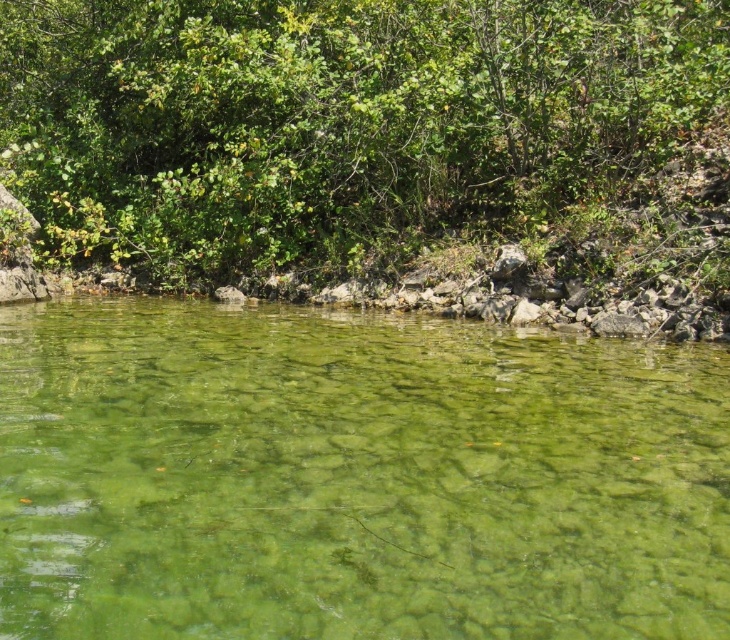
You are standing at the edge of the water and want to reach both the point at coordinates point (583,632) and point (64,88). Which point should you reach first to ensure you are moving towards the nearest one?

You should reach point (583,632) first because it is closer to you than point (64,88).

You are a hiker who wants to cross the clear water at center to reach the green leafy bush at upper center. The water is 6.67 meters wide. If your longest hiking pole is 6 meters, can you safely cross the water using the pole to measure the distance?

The clear water at center and green leafy bush at upper center are 6.67 meters apart. Since the longest hiking pole is only 6 meters, it is not long enough to reach the other side. You may need to find a longer tool or alternative path.

You are an environmental scientist assessing the ecosystem. You observe the clear water at center and the green leafy bush at upper center. Which object occupies a larger area in the scene?

The green leafy bush at upper center occupies a larger area in the scene compared to the clear water at center.